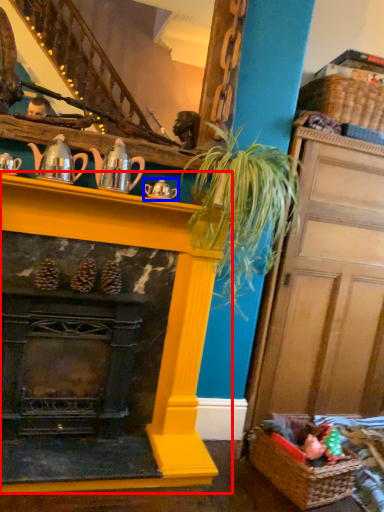
Question: Which object appears farthest to the camera in this image, fireplace (highlighted by a red box) or tea pot (highlighted by a blue box)?

Choices:
 (A) fireplace
 (B) tea pot

Answer: (B)